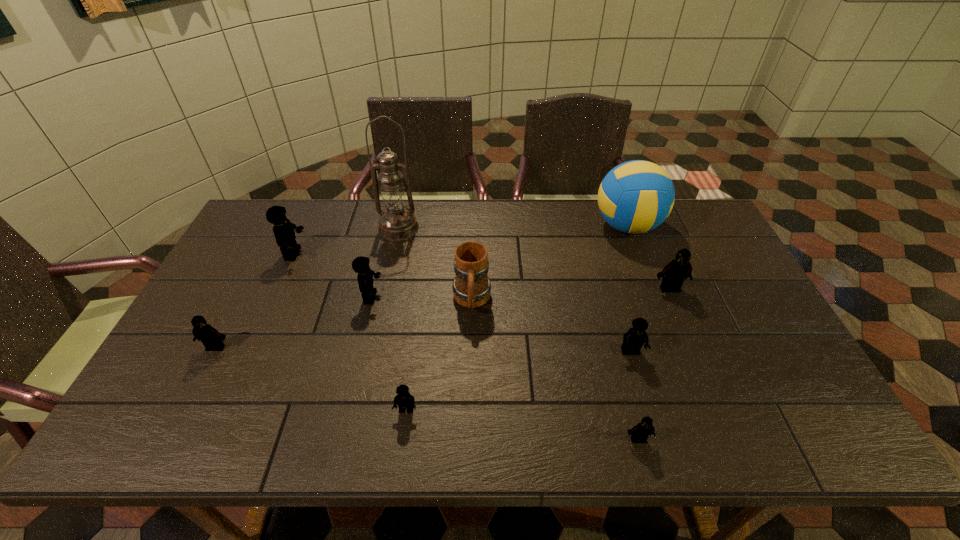
Locate an element on the screen. free space between the second yellow Lego from right to left and the leftmost yellow Lego is located at coordinates (350, 332).

What are the coordinates of `free spot between the third farthest yellow Lego and the blue volleyball` in the screenshot? It's located at (629, 289).

The height and width of the screenshot is (540, 960). Find the location of `vacant space that's between the nearest object and the biggest yellow Lego`. vacant space that's between the nearest object and the biggest yellow Lego is located at coordinates (466, 347).

Locate which object is the sixth closest to the sixth object from right to left. Please provide its 2D coordinates. Your answer should be formatted as a tuple, i.e. [(x, y)], where the tuple contains the x and y coordinates of a point satisfying the conditions above.

[(396, 223)]

Where is `object that stands as the closest to the volleyball`? object that stands as the closest to the volleyball is located at coordinates (673, 275).

Identify which Lego is the third nearest to the second yellow Lego from left to right. Please provide its 2D coordinates. Your answer should be formatted as a tuple, i.e. [(x, y)], where the tuple contains the x and y coordinates of a point satisfying the conditions above.

[(211, 338)]

Locate an element on the screen. The image size is (960, 540). Lego that is the third closest to the second farthest black Lego is located at coordinates (405, 401).

Point out which yellow Lego is positioned as the second nearest to the farthest black Lego. Please provide its 2D coordinates. Your answer should be formatted as a tuple, i.e. [(x, y)], where the tuple contains the x and y coordinates of a point satisfying the conditions above.

[(405, 401)]

Locate which yellow Lego ranks fourth in proximity to the blue volleyball. Please provide its 2D coordinates. Your answer should be formatted as a tuple, i.e. [(x, y)], where the tuple contains the x and y coordinates of a point satisfying the conditions above.

[(283, 229)]

Select which black Lego is the third closest to the third biggest yellow Lego. Please provide its 2D coordinates. Your answer should be formatted as a tuple, i.e. [(x, y)], where the tuple contains the x and y coordinates of a point satisfying the conditions above.

[(211, 338)]